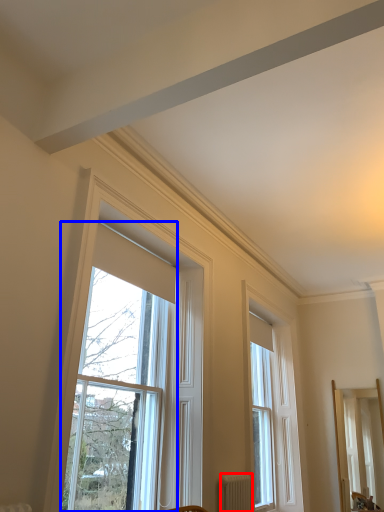
Question: Among these objects, which one is farthest to the camera, radiator (highlighted by a red box) or window (highlighted by a blue box)?

Choices:
 (A) radiator
 (B) window

Answer: (A)